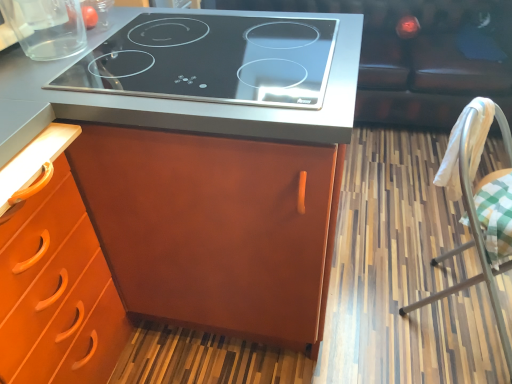
Question: Can you see white fabric-covered chair at right touching transparent glass container at upper left?

Choices:
 (A) yes
 (B) no

Answer: (B)

Question: Does white fabric-covered chair at right have a greater width compared to transparent glass container at upper left?

Choices:
 (A) no
 (B) yes

Answer: (B)

Question: Is white fabric-covered chair at right bigger than transparent glass container at upper left?

Choices:
 (A) yes
 (B) no

Answer: (A)

Question: From a real-world perspective, is white fabric-covered chair at right located higher than transparent glass container at upper left?

Choices:
 (A) no
 (B) yes

Answer: (A)

Question: Is transparent glass container at upper left completely or partially inside white fabric-covered chair at right?

Choices:
 (A) no
 (B) yes

Answer: (A)

Question: Is white fabric-covered chair at right outside transparent glass container at upper left?

Choices:
 (A) no
 (B) yes

Answer: (B)

Question: Is black glass cooktop at upper center a part of transparent glass container at upper left?

Choices:
 (A) no
 (B) yes

Answer: (A)

Question: Can you confirm if transparent glass container at upper left is taller than black glass cooktop at upper center?

Choices:
 (A) no
 (B) yes

Answer: (B)

Question: Is transparent glass container at upper left positioned far away from black glass cooktop at upper center?

Choices:
 (A) no
 (B) yes

Answer: (A)

Question: Is transparent glass container at upper left looking in the opposite direction of black glass cooktop at upper center?

Choices:
 (A) no
 (B) yes

Answer: (A)

Question: Is transparent glass container at upper left thinner than black glass cooktop at upper center?

Choices:
 (A) no
 (B) yes

Answer: (B)

Question: Is transparent glass container at upper left bigger than black glass cooktop at upper center?

Choices:
 (A) no
 (B) yes

Answer: (A)

Question: Is transparent glass container at upper left not within leather couch at upper right?

Choices:
 (A) yes
 (B) no

Answer: (A)